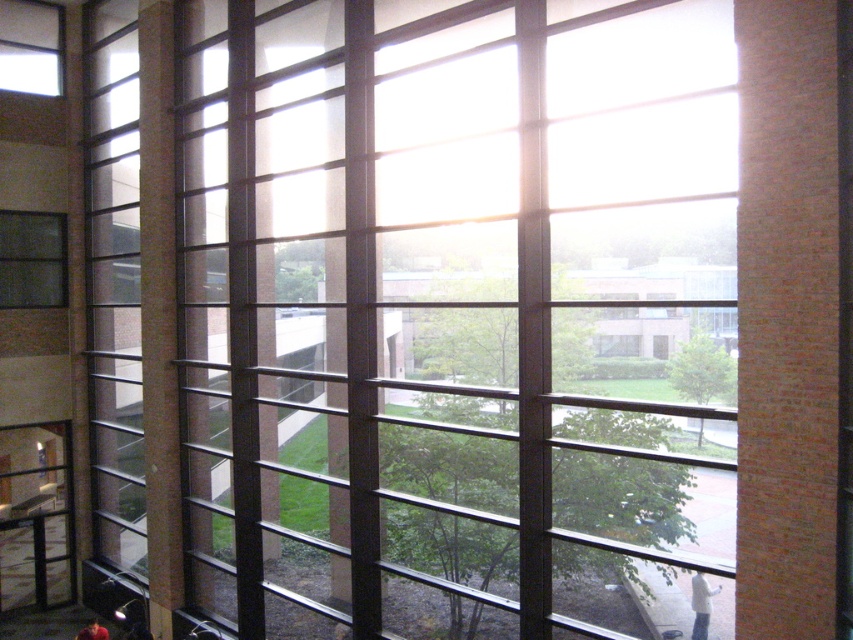
Question: Which of the following is the closest to the observer?

Choices:
 (A) (61, 269)
 (B) (579, 468)

Answer: (B)

Question: Is transparent glass window at center to the left of matte glass window at left from the viewer's perspective?

Choices:
 (A) yes
 (B) no

Answer: (B)

Question: Can you confirm if transparent glass window at center is thinner than matte glass window at left?

Choices:
 (A) no
 (B) yes

Answer: (A)

Question: Is transparent glass window at center above matte glass window at left?

Choices:
 (A) no
 (B) yes

Answer: (A)